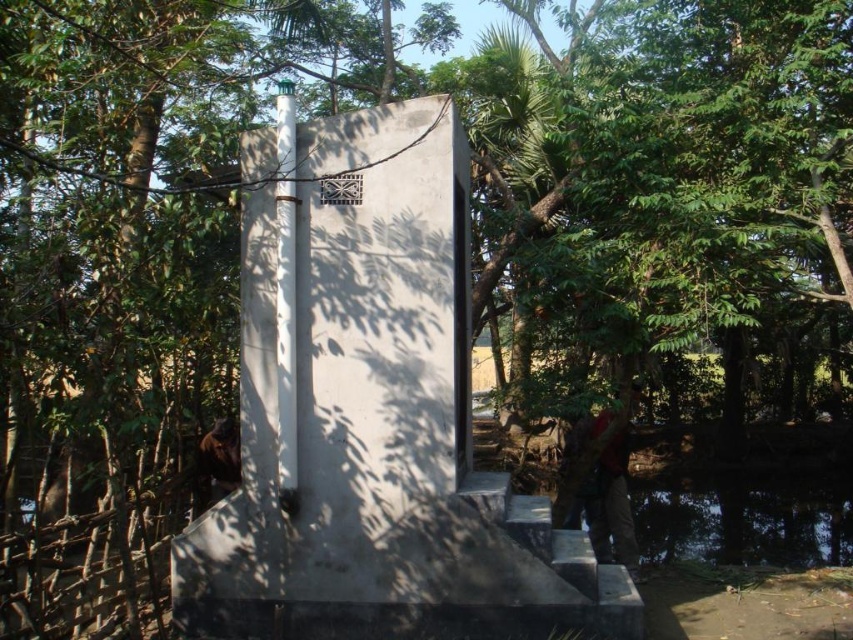
You are standing in front of the concrete structure and see the transparent glass pond at lower right and the red fabric jacket at lower right. Which object is closer to the ground?

The transparent glass pond at lower right is positioned under the red fabric jacket at lower right, so the transparent glass pond at lower right is closer to the ground.

You are standing in front of the concrete structure and want to place a new item in the area. You have a small decorative statue that needs to be placed where there is more space. Which object between the transparent glass pond at lower right and the red fabric jacket at lower right should you choose?

The red fabric jacket at lower right occupies more space than the transparent glass pond at lower right, so you should place the small decorative statue near the red fabric jacket at lower right.

You are standing in front of the concrete structure and see a point at coordinates (x=611, y=504). Based on the scene description, what object is this point located on?

The point at coordinates (x=611, y=504) is located on the red fabric jacket at lower right.